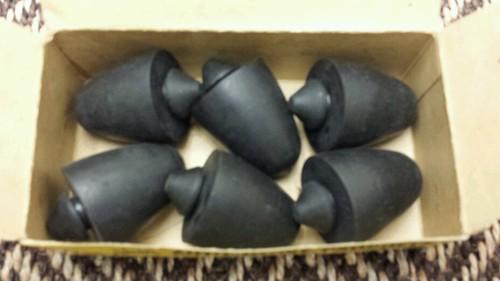
Identify the location of bottom of cardboard box. (257, 251).